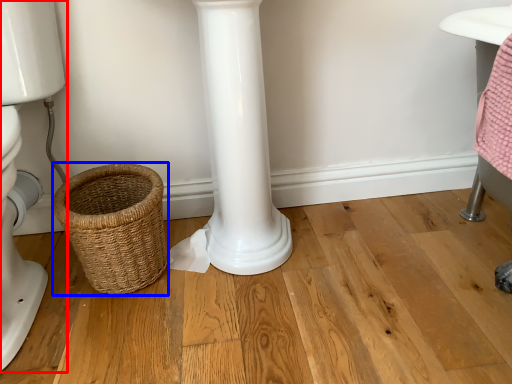
Question: Which object appears farthest to the camera in this image, toilet (highlighted by a red box) or basket (highlighted by a blue box)?

Choices:
 (A) toilet
 (B) basket

Answer: (B)